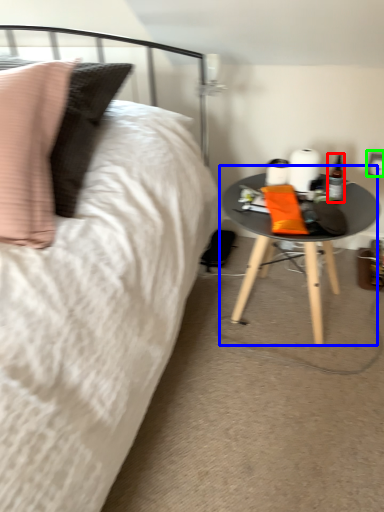
Question: Considering the real-world distances, which object is farthest from bottle (highlighted by a red box)? table (highlighted by a blue box) or electric outlet (highlighted by a green box)?

Choices:
 (A) table
 (B) electric outlet

Answer: (A)